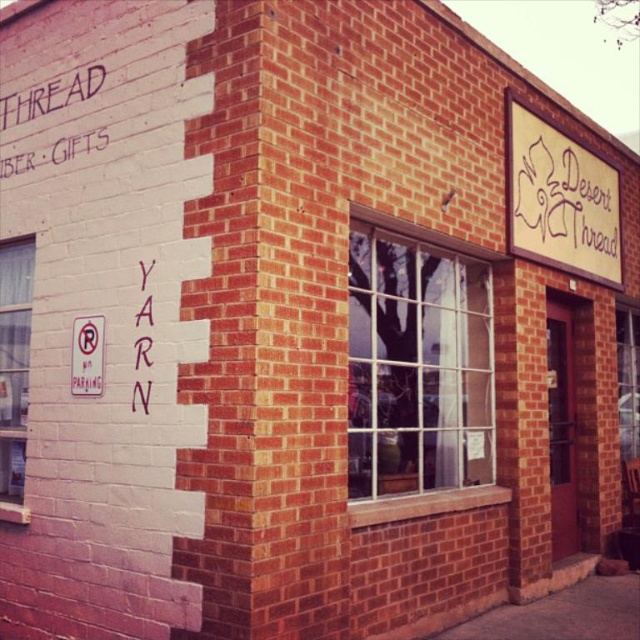
Measure the distance between clear glass window at center and camera.

clear glass window at center is 4.34 meters from camera.

Which is in front, point (396, 401) or point (145, 344)?

Positioned in front is point (145, 344).

Describe the element at coordinates (417, 360) in the screenshot. I see `clear glass window at center` at that location.

At what (x,y) coordinates should I click in order to perform the action: click on clear glass window at center. Please return your answer as a coordinate pair (x, y). This screenshot has height=640, width=640. Looking at the image, I should click on pyautogui.click(x=417, y=360).

Image resolution: width=640 pixels, height=640 pixels. Find the location of `beige textured sign at upper right`. beige textured sign at upper right is located at coordinates (561, 198).

I want to click on beige textured sign at upper right, so click(x=561, y=198).

Does point (29, 160) come farther from viewer compared to point (74, 337)?

Yes, point (29, 160) is behind point (74, 337).

Measure the distance between white chalk writing at upper left and camera.

white chalk writing at upper left is 14.85 feet from camera.

The image size is (640, 640). Identify the location of white chalk writing at upper left. (51, 97).

Locate an element on the screen. This screenshot has height=640, width=640. white chalk writing at upper left is located at coordinates (51, 97).